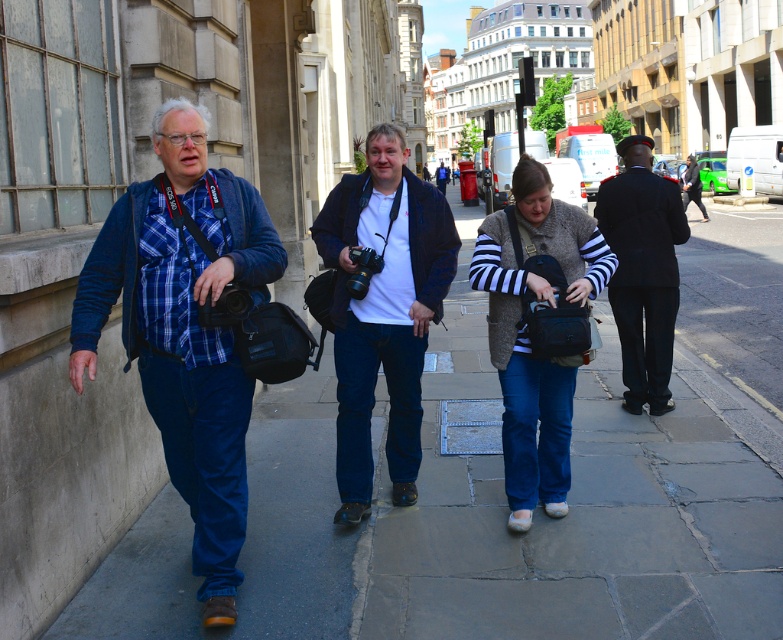
Question: Does black plastic camera at center have a lesser width compared to dark blue suit at center?

Choices:
 (A) yes
 (B) no

Answer: (A)

Question: Is matte black camera at center wider than striped sweater at center?

Choices:
 (A) yes
 (B) no

Answer: (A)

Question: Which of these objects is positioned farthest from the black plastic camera at center?

Choices:
 (A) striped sweater at center
 (B) blue plaid shirt at left
 (C) dark blue suit at center

Answer: (C)

Question: Based on their relative distances, which object is nearer to the dark blue suit at center?

Choices:
 (A) black uniform at right
 (B) paved stone sidewalk at left
 (C) blue plaid shirt at left
 (D) black plastic camera at center

Answer: (B)

Question: Which point is closer to the camera?

Choices:
 (A) (686, 163)
 (B) (623, 296)

Answer: (B)

Question: In this image, where is black uniform at right located relative to dark blue suit at center?

Choices:
 (A) left
 (B) right

Answer: (A)